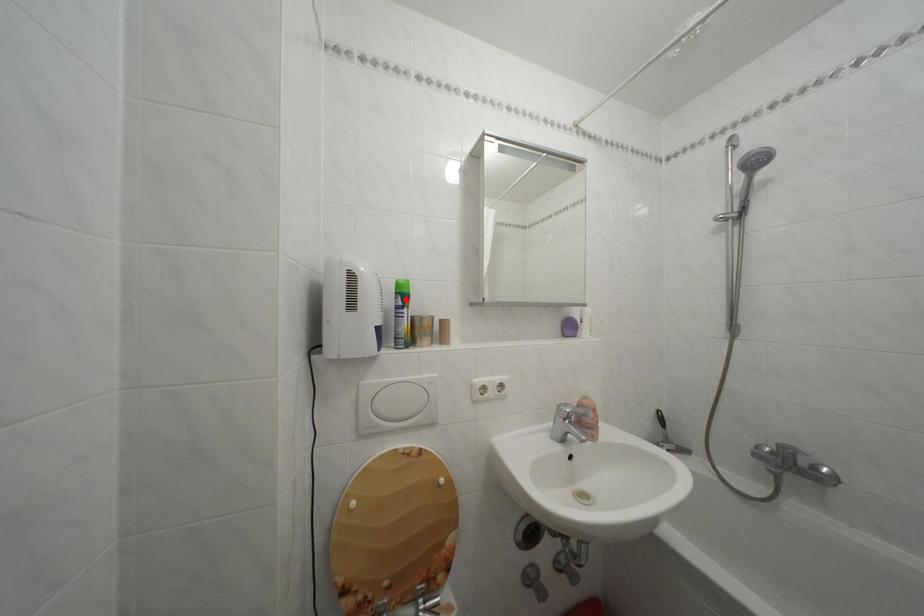
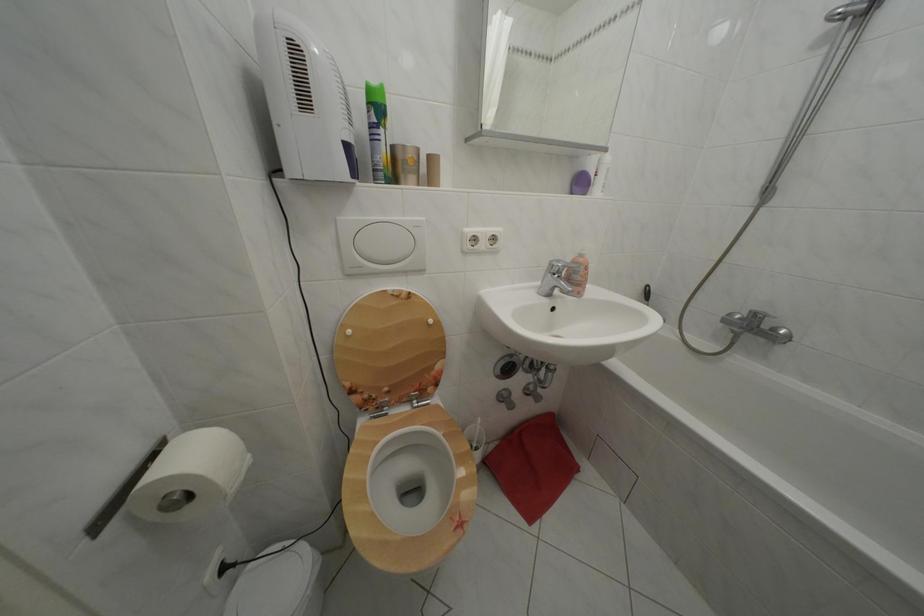
In the second image, find the point that corresponds to the highlighted location in the first image.

(378, 110)